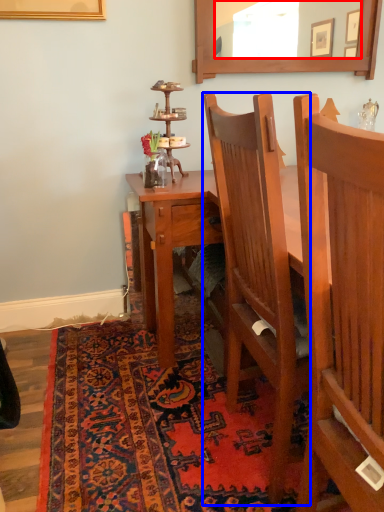
Question: Which of the following is the closest to the observer, mirror (highlighted by a red box) or chair (highlighted by a blue box)?

Choices:
 (A) mirror
 (B) chair

Answer: (B)